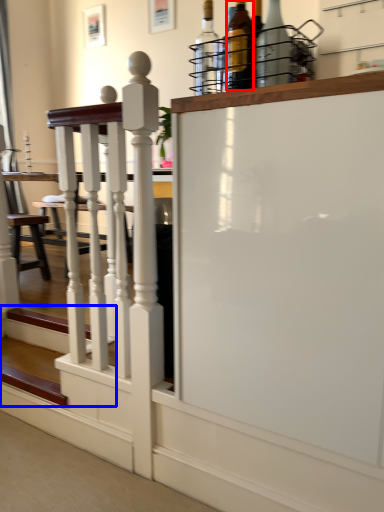
Question: Which of the following is the closest to the observer, bottle (highlighted by a red box) or stairs (highlighted by a blue box)?

Choices:
 (A) bottle
 (B) stairs

Answer: (A)